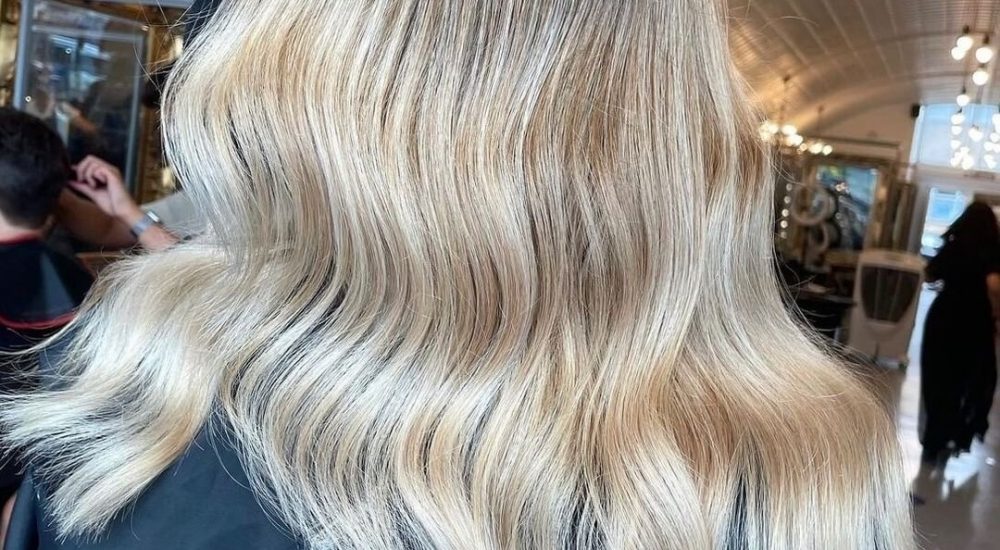
The width and height of the screenshot is (1000, 550). I want to click on lightbulb, so click(965, 40).